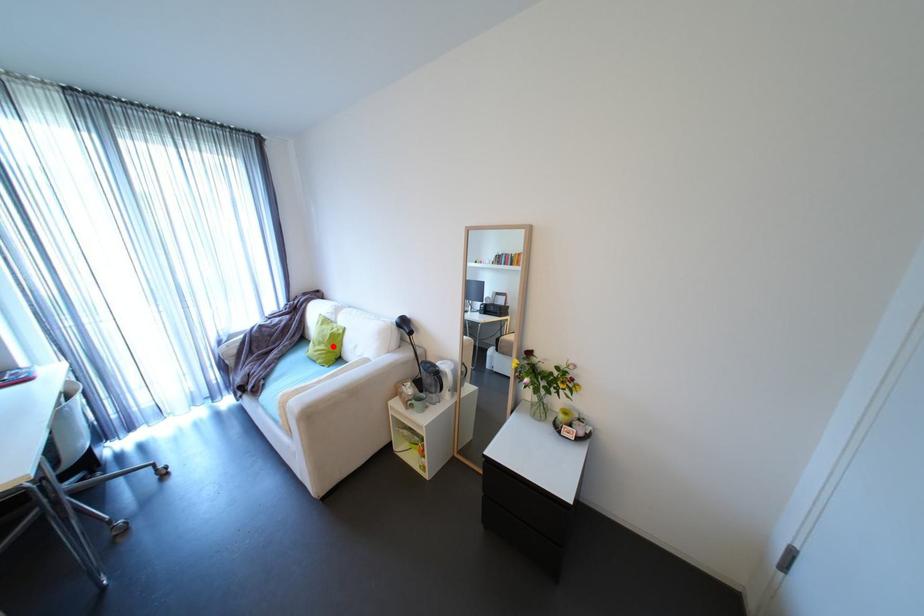
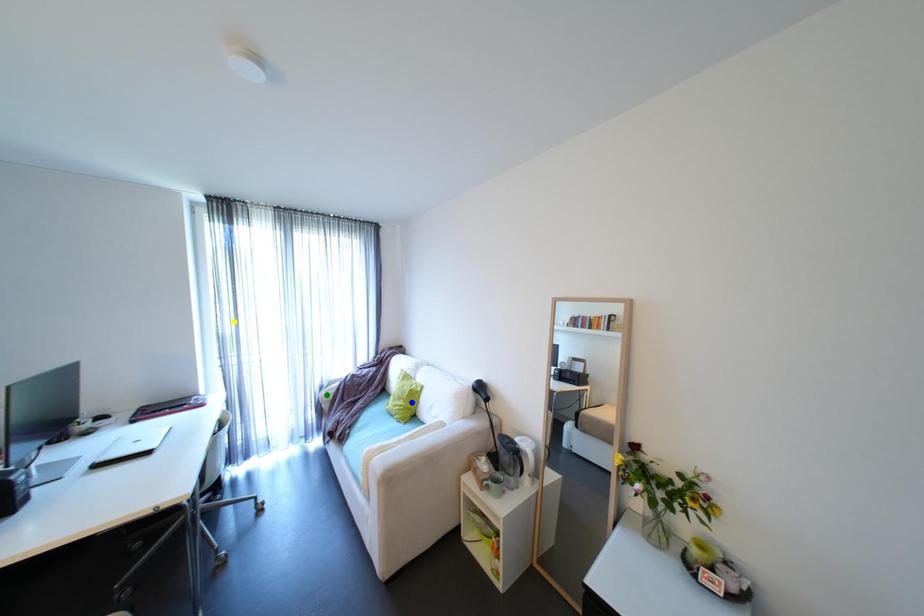
Question: I am providing you with two images of the same scene from different viewpoints. A red point is marked on the first image. You are given multiple points on the second image. Which mark in image 2 goes with the point in image 1?

Choices:
 (A) green point
 (B) yellow point
 (C) blue point

Answer: (C)